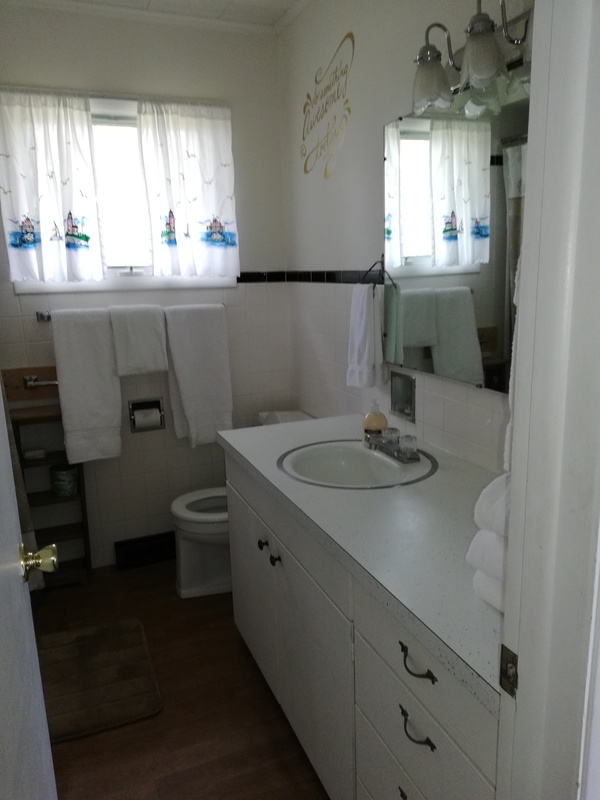
Where is `towels`? towels is located at coordinates (83, 365), (141, 341).